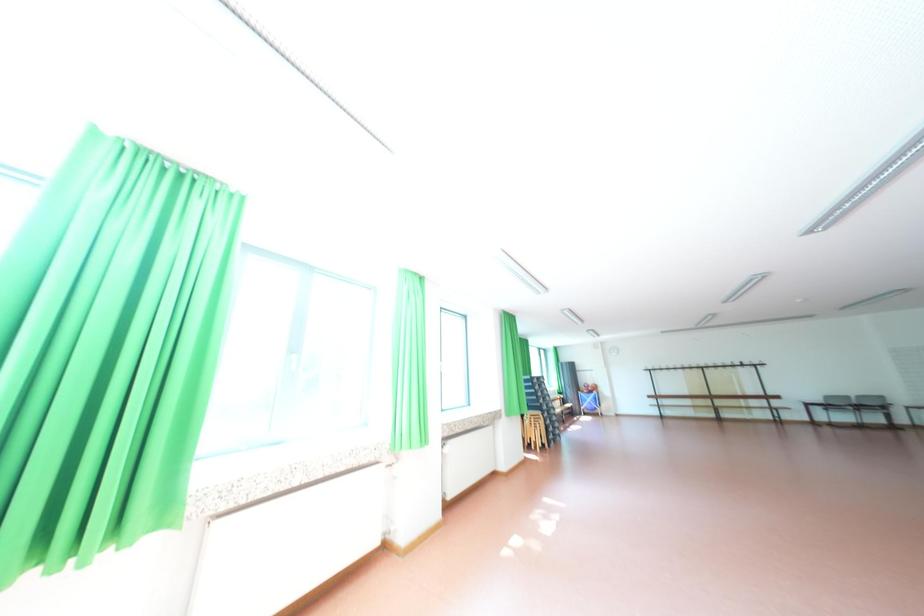
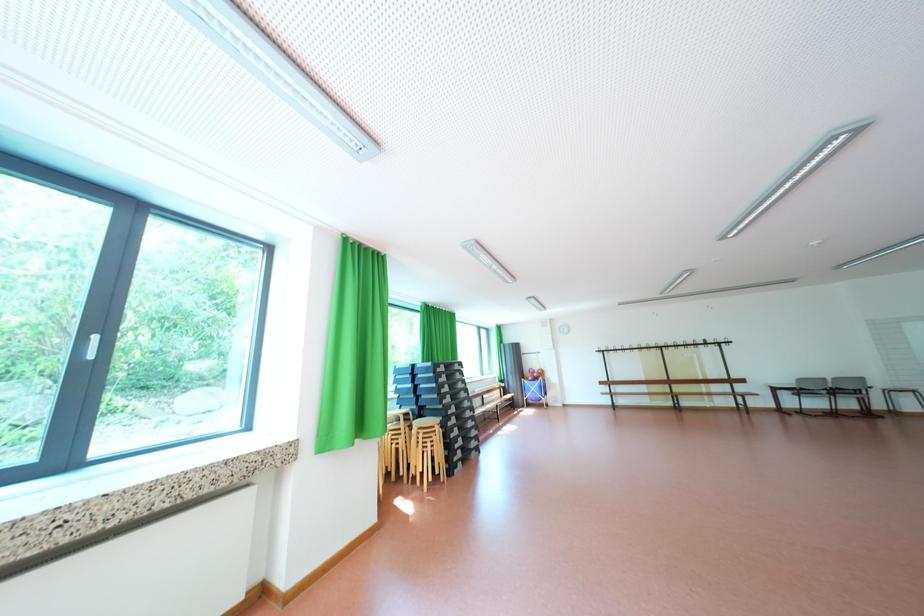
What movement of the cameraman would produce the second image?

The cameraman moved toward right, forward.